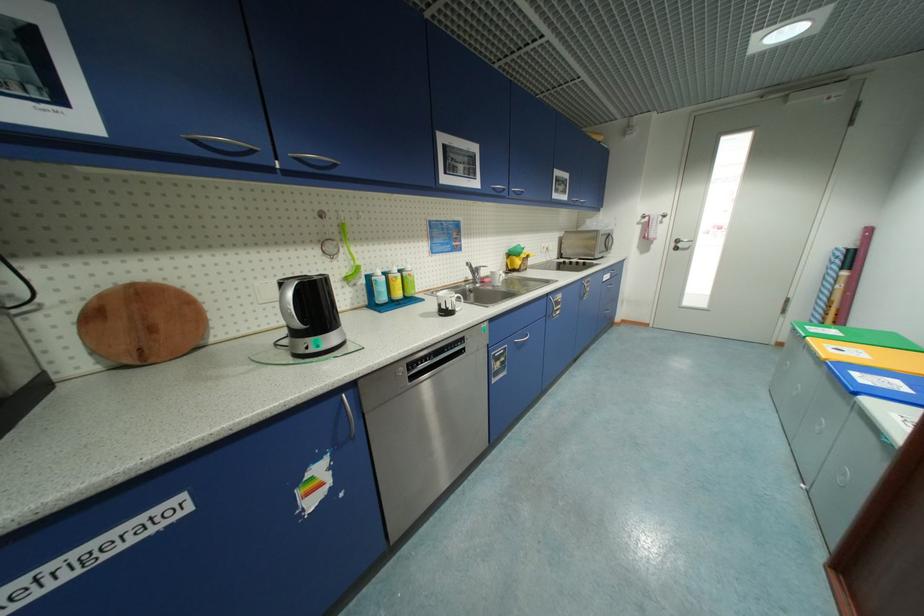
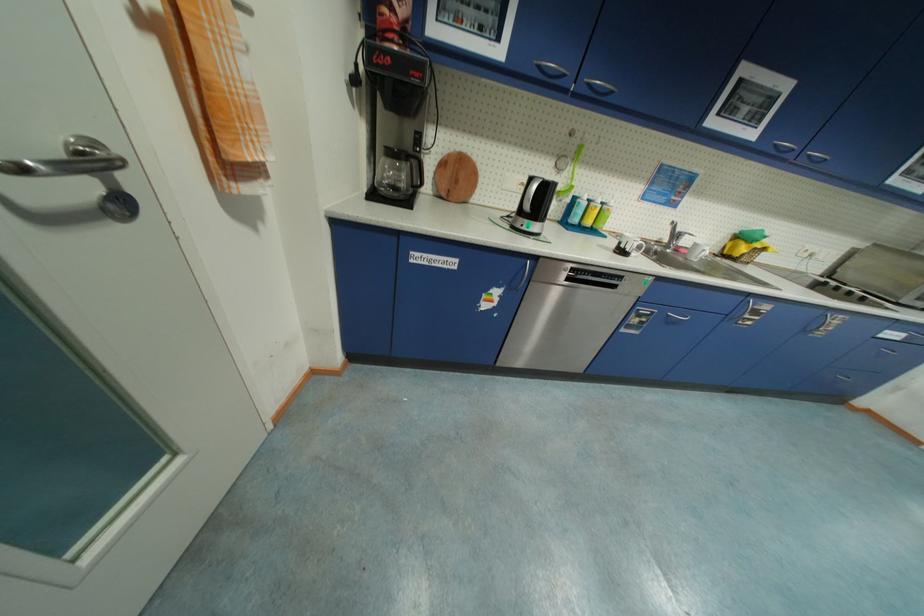
The point at (x=202, y=143) is marked in the first image. Where is the corresponding point in the second image?

(544, 69)